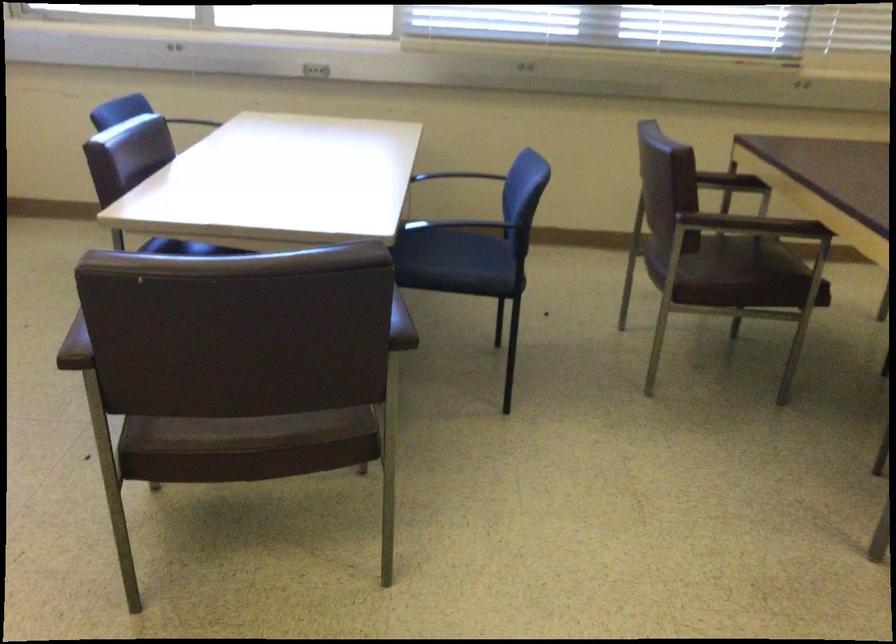
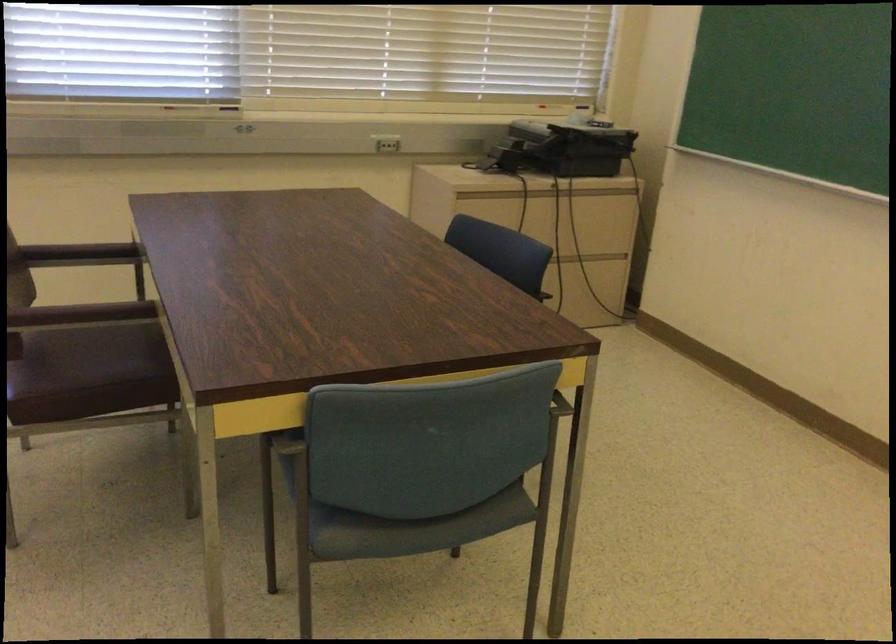
Question: How did the camera likely rotate?

Choices:
 (A) Left
 (B) Right
 (C) Up
 (D) Down

Answer: (B)